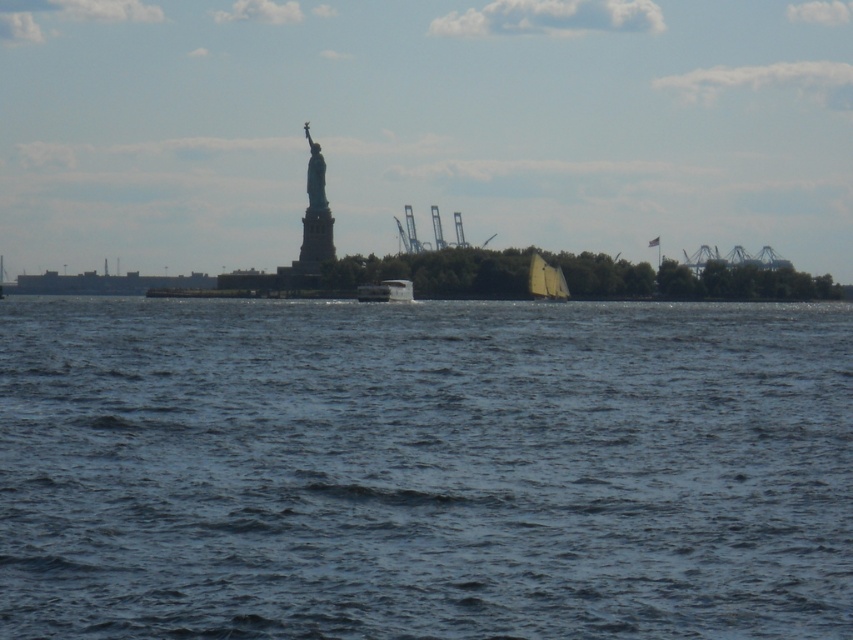
Who is higher up, blue water at center or white sailboat at center?

Positioned higher is white sailboat at center.

Does blue water at center have a lesser width compared to white sailboat at center?

Incorrect, blue water at center's width is not less than white sailboat at center's.

Which is behind, point (82, 342) or point (538, 289)?

The point (538, 289) is more distant.

Locate an element on the screen. This screenshot has width=853, height=640. blue water at center is located at coordinates (422, 468).

Does metallic statue at upper center appear under white glossy boat at center?

Actually, metallic statue at upper center is above white glossy boat at center.

Between metallic statue at upper center and white glossy boat at center, which one has less height?

white glossy boat at center

Where is `metallic statue at upper center`? This screenshot has height=640, width=853. metallic statue at upper center is located at coordinates (315, 216).

Does white sailboat at center have a lesser height compared to white glossy boat at center?

No, white sailboat at center is not shorter than white glossy boat at center.

Measure the distance from white sailboat at center to white glossy boat at center.

white sailboat at center is 15.77 meters from white glossy boat at center.

Where is `white sailboat at center`? This screenshot has width=853, height=640. white sailboat at center is located at coordinates (546, 280).